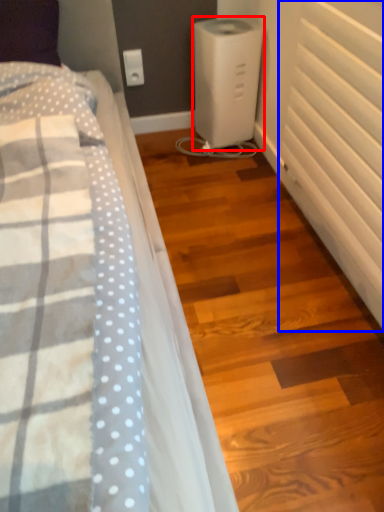
Question: Which point is further to the camera, home appliance (highlighted by a red box) or radiator (highlighted by a blue box)?

Choices:
 (A) home appliance
 (B) radiator

Answer: (A)